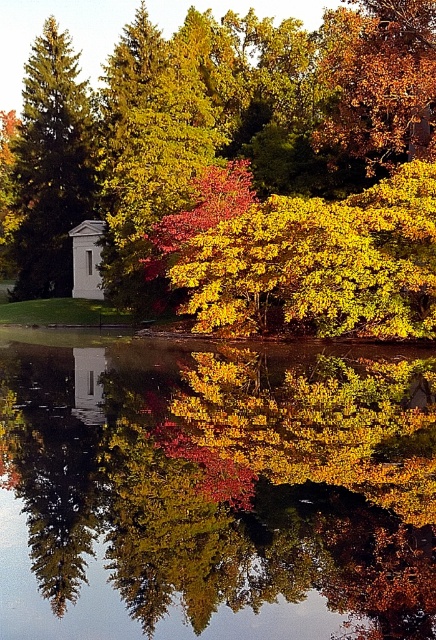
Question: Is white glossy stone at center wider than golden textured leaves at upper right?

Choices:
 (A) yes
 (B) no

Answer: (A)

Question: Estimate the real-world distances between objects in this image. Which object is closer to the golden textured leaves at upper right?

Choices:
 (A) transparent glass lake at center
 (B) white glossy stone at center
 (C) green matte tree at left

Answer: (C)

Question: Does green matte tree at left have a smaller size compared to golden textured leaves at upper right?

Choices:
 (A) no
 (B) yes

Answer: (B)

Question: Based on their relative distances, which object is nearer to the golden textured leaves at upper right?

Choices:
 (A) green matte tree at left
 (B) transparent glass lake at center
 (C) white glossy stone at center

Answer: (A)

Question: Does green matte tree at left appear over golden textured leaves at upper right?

Choices:
 (A) yes
 (B) no

Answer: (B)

Question: Which object is the farthest from the green matte tree at left?

Choices:
 (A) transparent glass lake at center
 (B) golden textured leaves at upper right

Answer: (A)